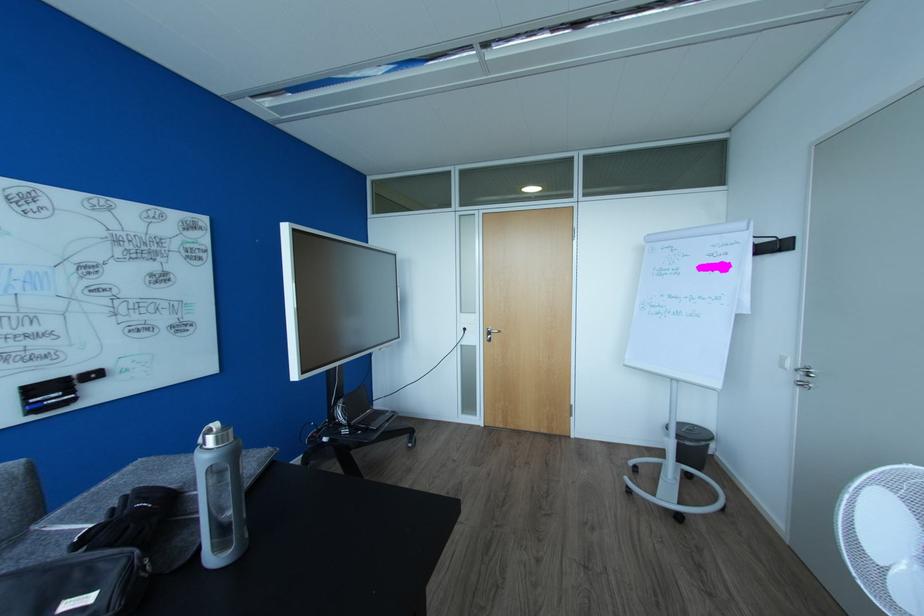
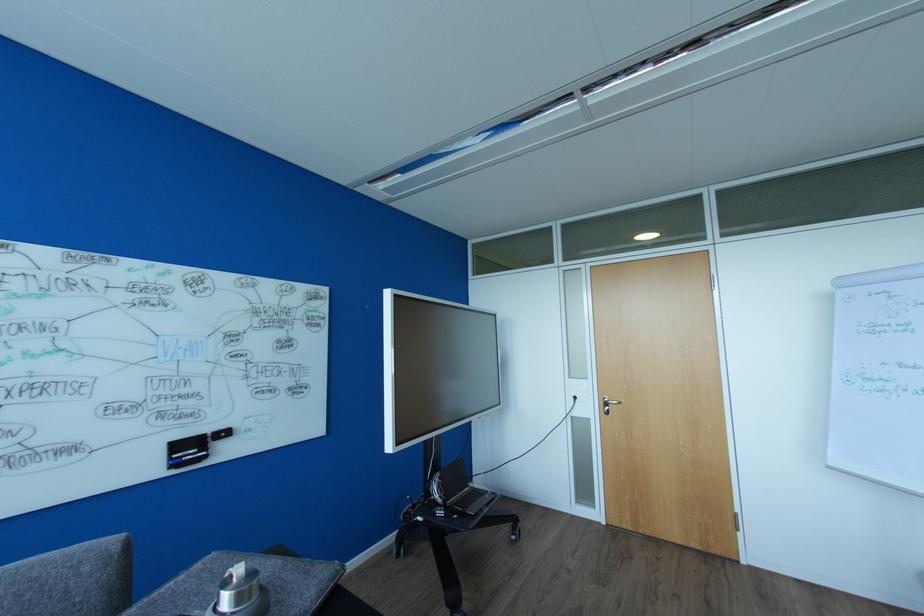
In the second image, find the point that corresponds to the point at 468,330 in the first image.

(578, 398)